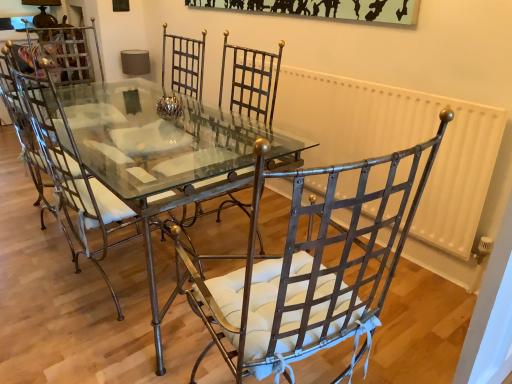
Question: In terms of width, does metallic woven chair at center, placed as the 2th chair when sorted from left to right, look wider or thinner when compared to matte metal chair at center, which is counted as the second chair, starting from the right?

Choices:
 (A) thin
 (B) wide

Answer: (A)

Question: In the image, is metallic woven chair at center, which is counted as the 1th chair, starting from the right, positioned in front of or behind matte metal chair at center, acting as the 1th chair starting from the left?

Choices:
 (A) behind
 (B) front

Answer: (B)

Question: Based on their relative distances, which object is nearer to the metallic glass table at center?

Choices:
 (A) metallic woven chair at center, placed as the 2th chair when sorted from left to right
 (B) white painted metal radiator at right
 (C) matte metal chair at center, acting as the 1th chair starting from the left

Answer: (C)

Question: Which is farther from the white painted metal radiator at right?

Choices:
 (A) matte metal chair at center, which is counted as the second chair, starting from the right
 (B) metallic glass table at center
 (C) metallic woven chair at center, placed as the 2th chair when sorted from left to right

Answer: (A)